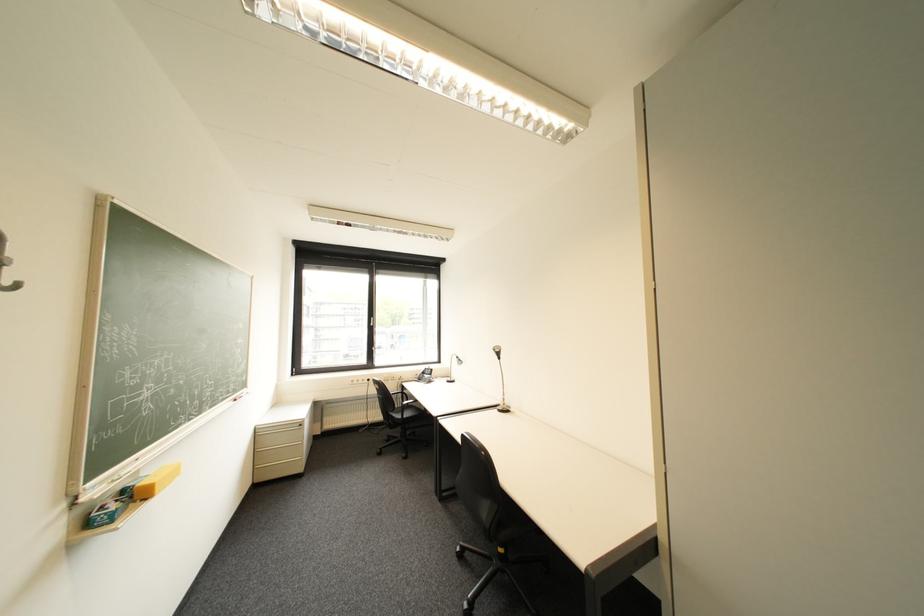
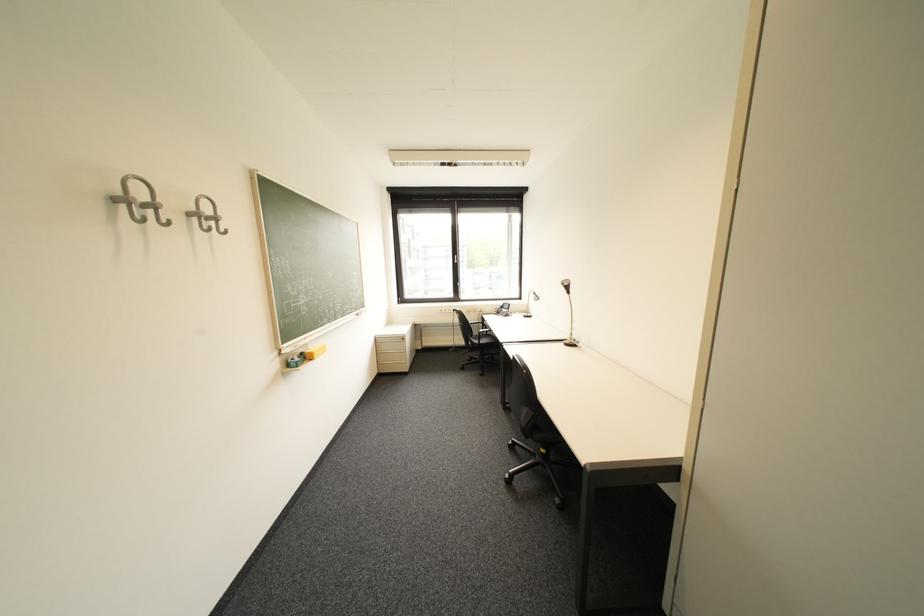
Where in the second image is the point corresponding to (446,360) from the first image?

(528, 297)